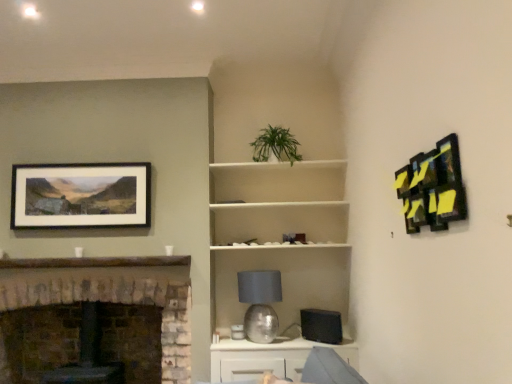
Question: From a real-world perspective, relative to stone fireplace at left, is matte black picture frame at upper left, the second picture frame from the right, vertically above or below?

Choices:
 (A) above
 (B) below

Answer: (A)

Question: In the image, is matte black picture frame at upper left, which is counted as the first picture frame, starting from the back, on the left side or the right side of stone fireplace at left?

Choices:
 (A) left
 (B) right

Answer: (A)

Question: Which object is the farthest from the green leafy plant at upper center?

Choices:
 (A) abstract painting at upper right, the 2th picture frame viewed from the left
 (B) white matte shelf at center
 (C) matte black picture frame at upper left, acting as the first picture frame starting from the left
 (D) silver metallic table lamp at center
 (E) stone fireplace at left

Answer: (A)

Question: Considering the real-world distances, which object is farthest from the abstract painting at upper right, placed as the 2th picture frame when sorted from back to front?

Choices:
 (A) green leafy plant at upper center
 (B) white glossy cabinet at lower center
 (C) stone fireplace at left
 (D) white matte shelf at center
 (E) silver metallic table lamp at center

Answer: (C)